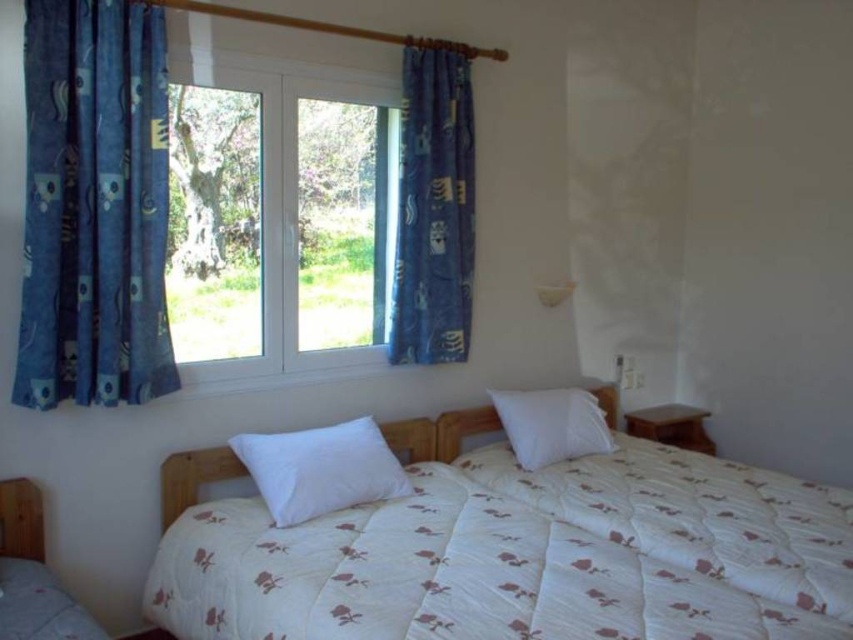
Can you confirm if white quilted bed at center is positioned below white quilted blanket at center?

Yes.

Can you confirm if white quilted bed at center is bigger than white quilted blanket at center?

Yes, white quilted bed at center is bigger than white quilted blanket at center.

Which is behind, point (664, 637) or point (616, 449)?

Positioned behind is point (616, 449).

Image resolution: width=853 pixels, height=640 pixels. I want to click on white quilted bed at center, so click(x=511, y=548).

Is white quilted bed at center to the right of blue printed fabric curtain at center from the viewer's perspective?

Indeed, white quilted bed at center is positioned on the right side of blue printed fabric curtain at center.

Between white quilted bed at center and blue printed fabric curtain at center, which one is positioned lower?

Positioned lower is white quilted bed at center.

Between point (544, 560) and point (444, 358), which one is positioned behind?

Point (444, 358)

Image resolution: width=853 pixels, height=640 pixels. In order to click on white quilted bed at center in this screenshot , I will do `click(511, 548)`.

Can you confirm if white soft pillow at center is smaller than white soft pillow at upper right?

Actually, white soft pillow at center might be larger than white soft pillow at upper right.

Which is behind, point (393, 458) or point (521, 445)?

Positioned behind is point (521, 445).

The height and width of the screenshot is (640, 853). I want to click on white soft pillow at center, so click(320, 468).